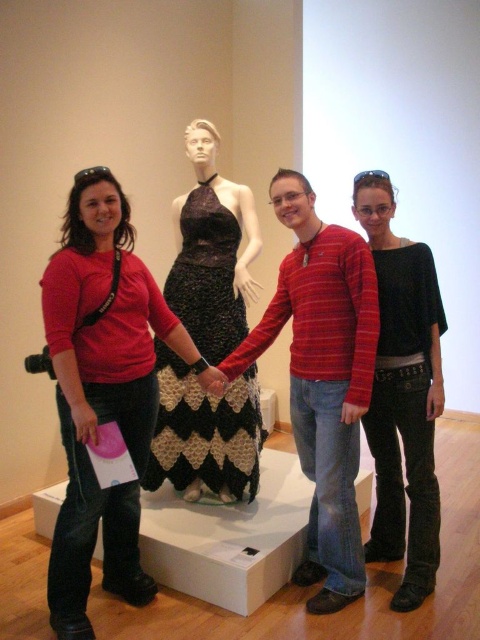
Question: Which of the following is the farthest from the observer?

Choices:
 (A) (379, 204)
 (B) (294, 388)
 (C) (105, 172)
 (D) (199, 224)

Answer: (D)

Question: Does matte red shirt at center appear over striped cotton shirt at center?

Choices:
 (A) yes
 (B) no

Answer: (B)

Question: Which point appears closest to the camera in this image?

Choices:
 (A) (216, 358)
 (B) (420, 476)

Answer: (B)

Question: Is matte red shirt at center bigger than black jersey at center?

Choices:
 (A) no
 (B) yes

Answer: (B)

Question: Does matte red shirt at center appear over black crochet dress at center?

Choices:
 (A) yes
 (B) no

Answer: (B)

Question: Which point is closer to the camera taking this photo?

Choices:
 (A) (73, 552)
 (B) (199, 275)
 (C) (376, 321)

Answer: (A)